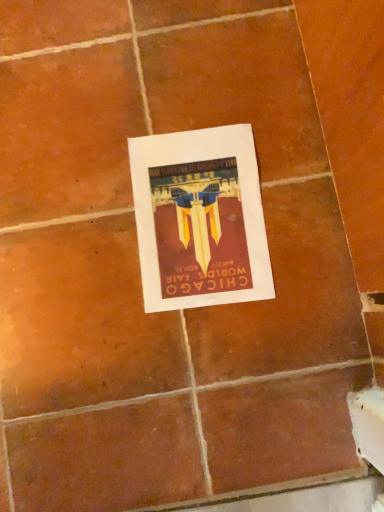
This screenshot has height=512, width=384. Find the location of `matte paper poster at center`. matte paper poster at center is located at coordinates (199, 219).

What do you see at coordinates (199, 219) in the screenshot? The image size is (384, 512). I see `matte paper poster at center` at bounding box center [199, 219].

This screenshot has width=384, height=512. I want to click on matte paper poster at center, so click(199, 219).